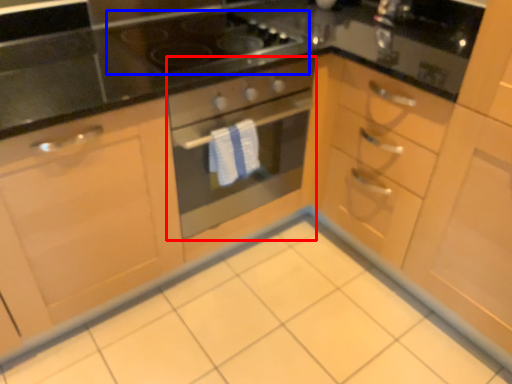
Question: Which point is closer to the camera, oven (highlighted by a red box) or gas stove (highlighted by a blue box)?

Choices:
 (A) oven
 (B) gas stove

Answer: (A)